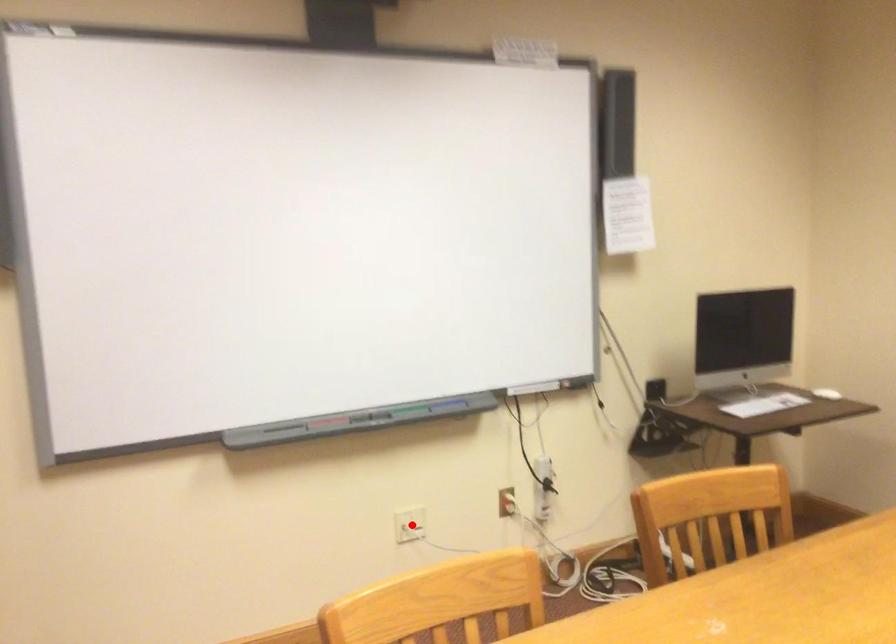
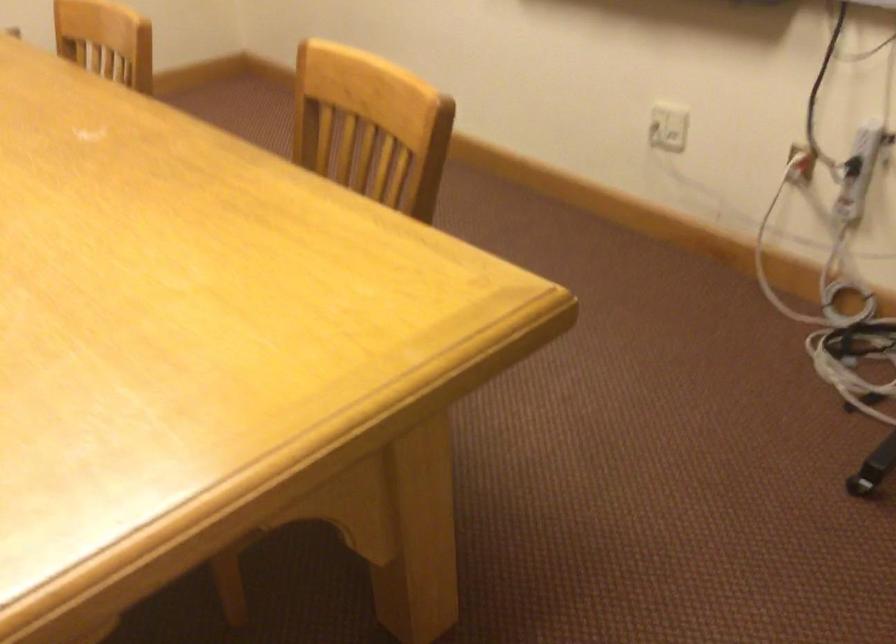
Where in the second image is the point corresponding to the highlighted location from the first image?

(668, 127)